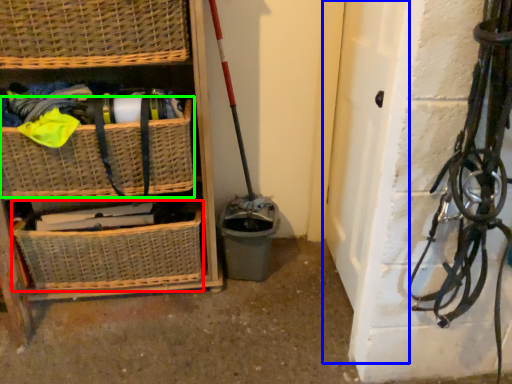
Question: Which object is positioned farthest from basket (highlighted by a red box)? Select from door (highlighted by a blue box) and basket (highlighted by a green box).

Choices:
 (A) door
 (B) basket

Answer: (A)